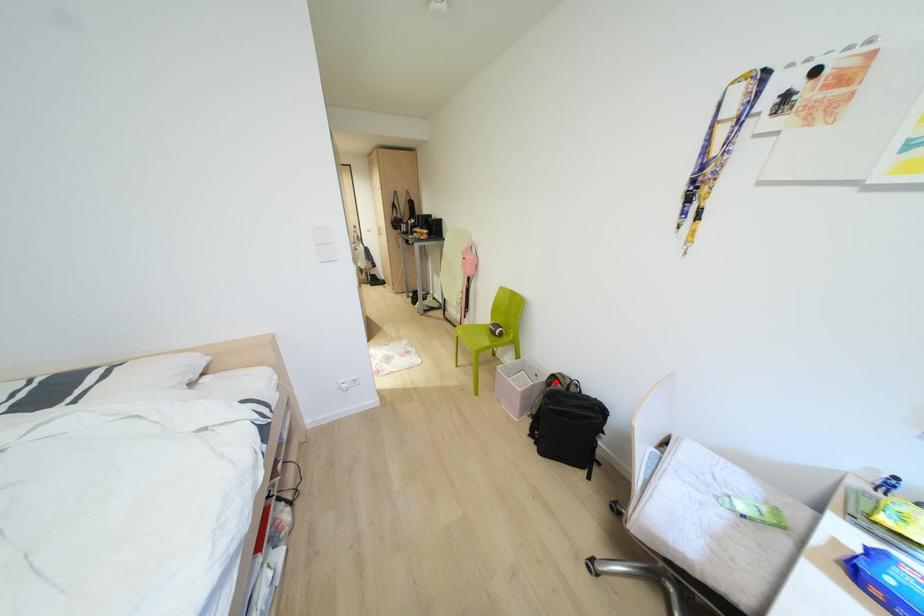
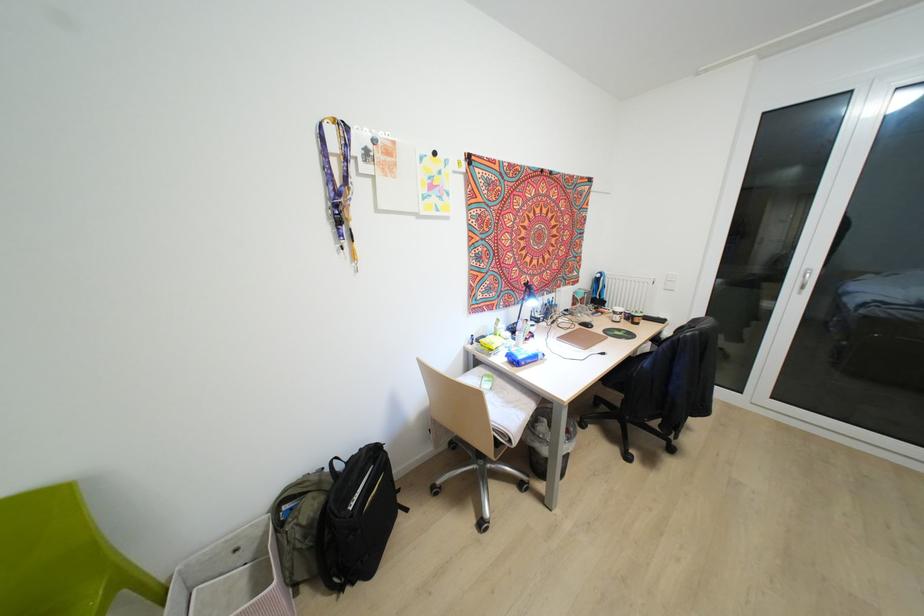
Where in the second image is the point corresponding to the highlighted location from the first image?

(285, 507)